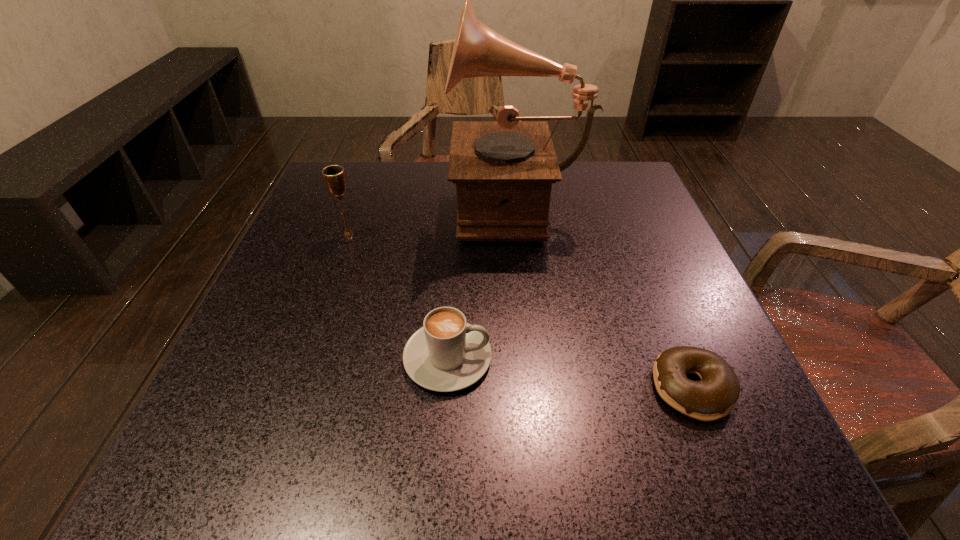
I want to click on vacant space that satisfies the following two spatial constraints: 1. to the right of the cappuccino; 2. on the right side of the shortest object, so click(445, 388).

The height and width of the screenshot is (540, 960). What are the coordinates of `vacant area that satisfies the following two spatial constraints: 1. on the horn of the tallest object; 2. on the left side of the shortest object` in the screenshot? It's located at (536, 388).